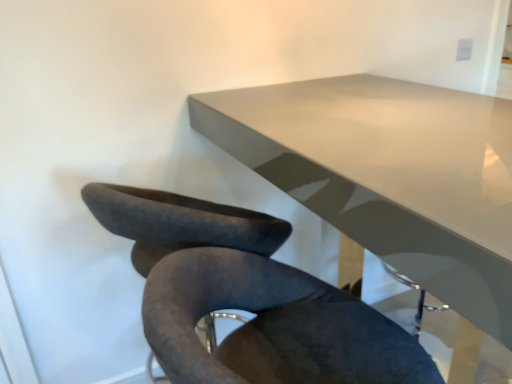
Question: Is velvet dark gray chair at lower center aimed at white glossy table at upper center?

Choices:
 (A) no
 (B) yes

Answer: (B)

Question: Considering the relative positions of velvet dark gray chair at lower center and white glossy table at upper center in the image provided, is velvet dark gray chair at lower center behind white glossy table at upper center?

Choices:
 (A) no
 (B) yes

Answer: (A)

Question: Considering the relative sizes of velvet dark gray chair at lower center and white glossy table at upper center in the image provided, is velvet dark gray chair at lower center taller than white glossy table at upper center?

Choices:
 (A) yes
 (B) no

Answer: (B)

Question: Considering the relative sizes of velvet dark gray chair at lower center and white glossy table at upper center in the image provided, is velvet dark gray chair at lower center thinner than white glossy table at upper center?

Choices:
 (A) no
 (B) yes

Answer: (B)

Question: Does velvet dark gray chair at lower center have a larger size compared to white glossy table at upper center?

Choices:
 (A) yes
 (B) no

Answer: (B)

Question: Can white glossy table at upper center be found inside velvet dark gray chair at lower center?

Choices:
 (A) no
 (B) yes

Answer: (A)

Question: Is velvet dark gray chair at lower center inside white glossy table at upper center?

Choices:
 (A) no
 (B) yes

Answer: (B)

Question: Is white glossy table at upper center smaller than velvet dark gray chair at lower center?

Choices:
 (A) no
 (B) yes

Answer: (A)

Question: Can you confirm if white glossy table at upper center is taller than velvet dark gray chair at lower center?

Choices:
 (A) yes
 (B) no

Answer: (A)

Question: Can you confirm if white glossy table at upper center is bigger than velvet dark gray chair at lower center?

Choices:
 (A) yes
 (B) no

Answer: (A)

Question: From the image's perspective, is white glossy table at upper center beneath velvet dark gray chair at lower center?

Choices:
 (A) yes
 (B) no

Answer: (B)

Question: Is white glossy table at upper center next to velvet dark gray chair at lower center?

Choices:
 (A) yes
 (B) no

Answer: (B)

Question: In terms of width, does velvet dark gray chair at lower center look wider or thinner when compared to white glossy table at upper center?

Choices:
 (A) thin
 (B) wide

Answer: (A)